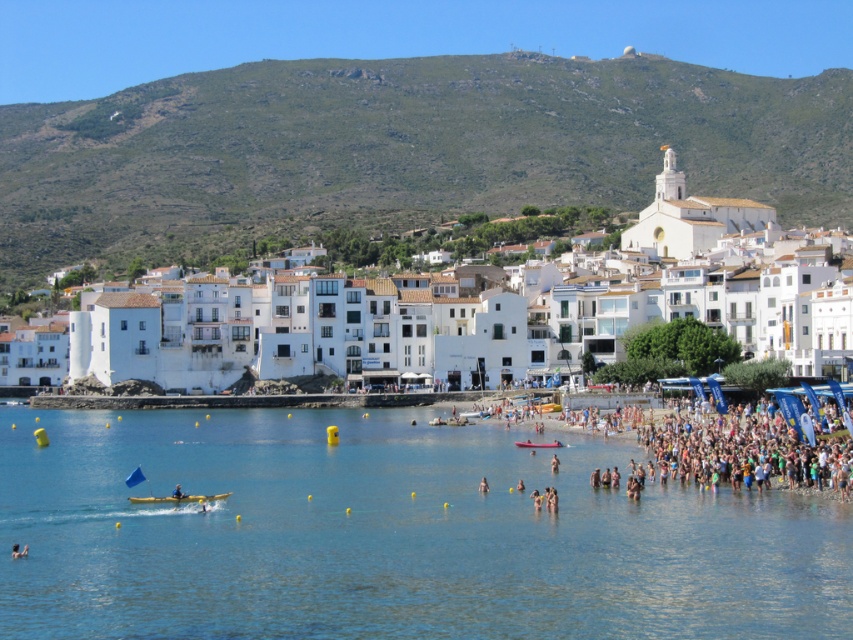
You are planning to take a photo of both the white matte buildings at center and the smooth skin person at lower left from your current position. Given that your camera has a maximum focus range of 100 meters, will you be able to capture both subjects in sharp focus without moving your position?

The white matte buildings at center and smooth skin person at lower left are 112.92 meters apart, which exceeds the camera maximum focus range of 100 meters. Therefore, you cannot capture both subjects in sharp focus without moving your position.

You are a photographer standing at the edge of the beach, and you want to take a photo that includes both the point at coordinates point (317, 168) and point (525, 444). Which point will appear closer to the front of the photo?

Point (317, 168) is further to the camera than point (525, 444), so in the photo, point (317, 168) will appear closer to the front of the photo.

Based on the photo, you are a photographer planning to take a photo of the pink rubber boat at center and the green grassy hillside at upper center. Which object should you focus on first if you want to capture both in a single shot without moving the camera?

The green grassy hillside at upper center is above the pink rubber boat at center, so you should focus on the pink rubber boat at center first since it is closer to the camera, then adjust to capture the green grassy hillside at upper center in the background.